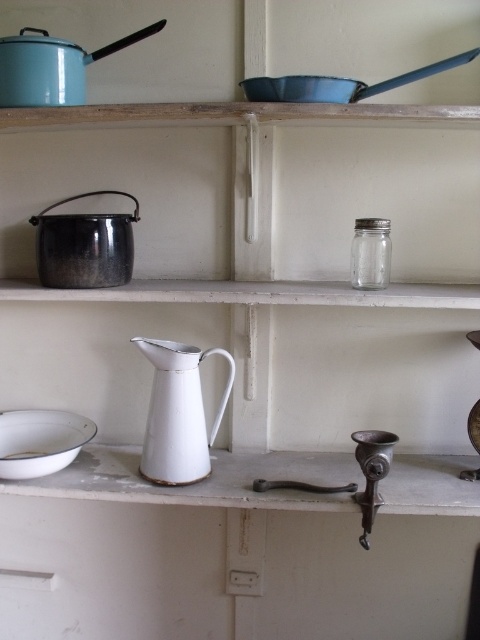
Question: Is white enameled pitcher at center further to the viewer compared to white enamel plate at lower left?

Choices:
 (A) no
 (B) yes

Answer: (A)

Question: Does white enameled pitcher at center lie in front of white enamel plate at lower left?

Choices:
 (A) no
 (B) yes

Answer: (B)

Question: Estimate the real-world distances between objects in this image. Which object is farther from the white enameled pitcher at center?

Choices:
 (A) white enamel plate at lower left
 (B) enamel blue pot at upper left

Answer: (B)

Question: From the image, what is the correct spatial relationship of enamel blue pot at upper left in relation to white enamel plate at lower left?

Choices:
 (A) right
 (B) left

Answer: (A)

Question: Which of these objects is positioned farthest from the enamel blue pot at upper left?

Choices:
 (A) white enamel plate at lower left
 (B) white enameled pitcher at center

Answer: (A)

Question: Which object appears farthest from the camera in this image?

Choices:
 (A) white enamel plate at lower left
 (B) white enameled pitcher at center

Answer: (A)